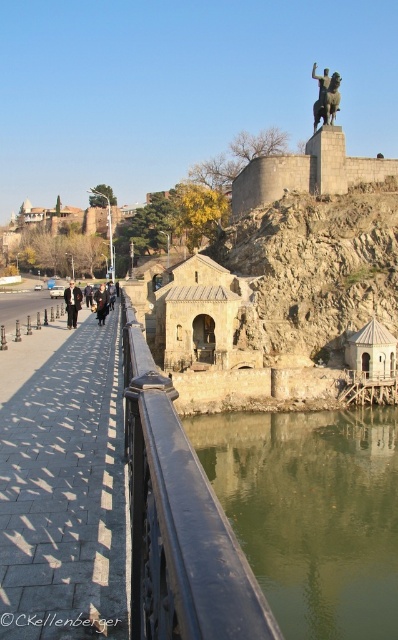
Question: Can you confirm if bronze statue at upper center is thinner than black fabric person at center?

Choices:
 (A) yes
 (B) no

Answer: (A)

Question: Which object is positioned closest to the bronze statue at upper center?

Choices:
 (A) dark brown leather jacket at left
 (B) green reflective water at lower center
 (C) black metal railing at center

Answer: (A)

Question: Considering the real-world distances, which object is closest to the black concrete sidewalk at center?

Choices:
 (A) green reflective water at lower center
 (B) dark brown leather jacket at left
 (C) black metal railing at center

Answer: (C)

Question: Which point is farther from the camera taking this photo?

Choices:
 (A) (99, 369)
 (B) (325, 81)
 (C) (87, 305)

Answer: (B)

Question: Is black concrete sidewalk at center to the left of bronze statue at upper center from the viewer's perspective?

Choices:
 (A) yes
 (B) no

Answer: (A)

Question: Does green reflective water at lower center have a smaller size compared to black metal railing at center?

Choices:
 (A) no
 (B) yes

Answer: (A)